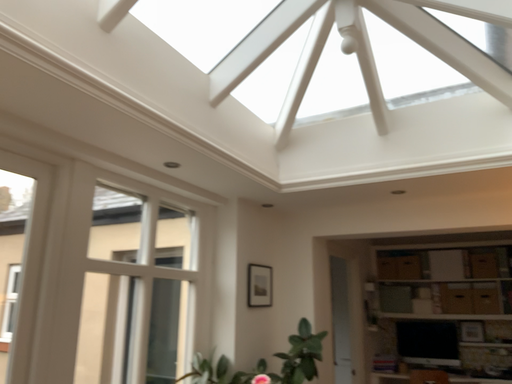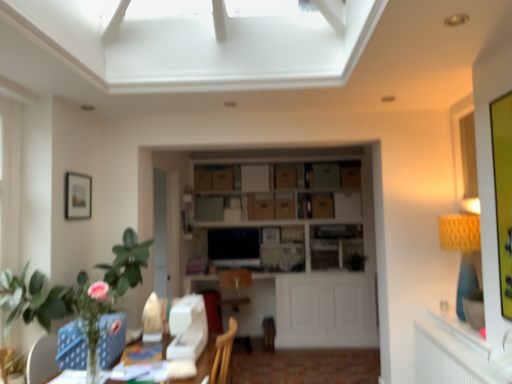
Question: How did the camera likely rotate when shooting the video?

Choices:
 (A) rotated upward
 (B) rotated downward

Answer: (B)